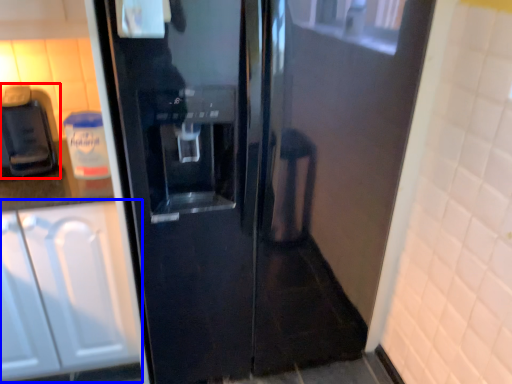
Question: Among these objects, which one is nearest to the camera, coffee machine (highlighted by a red box) or cabinetry (highlighted by a blue box)?

Choices:
 (A) coffee machine
 (B) cabinetry

Answer: (B)